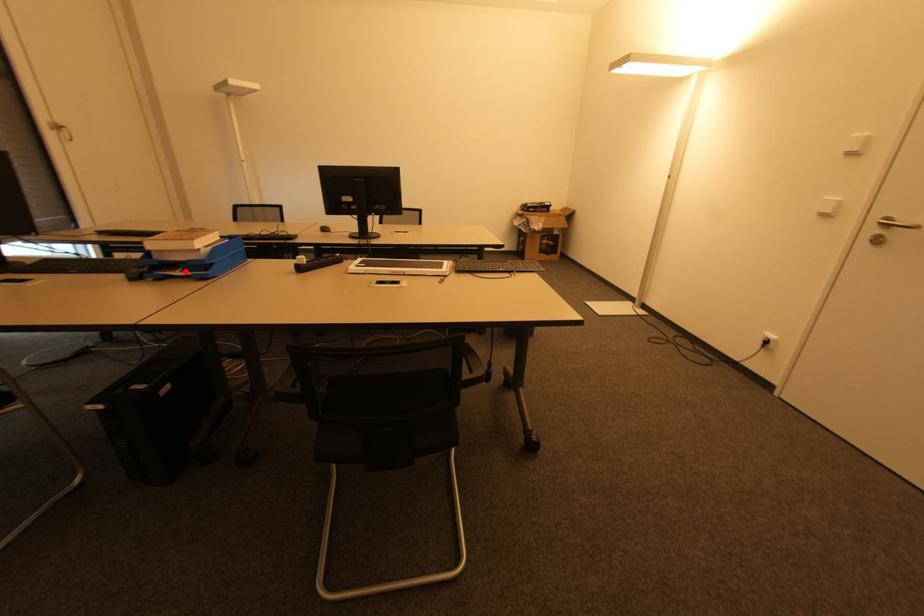
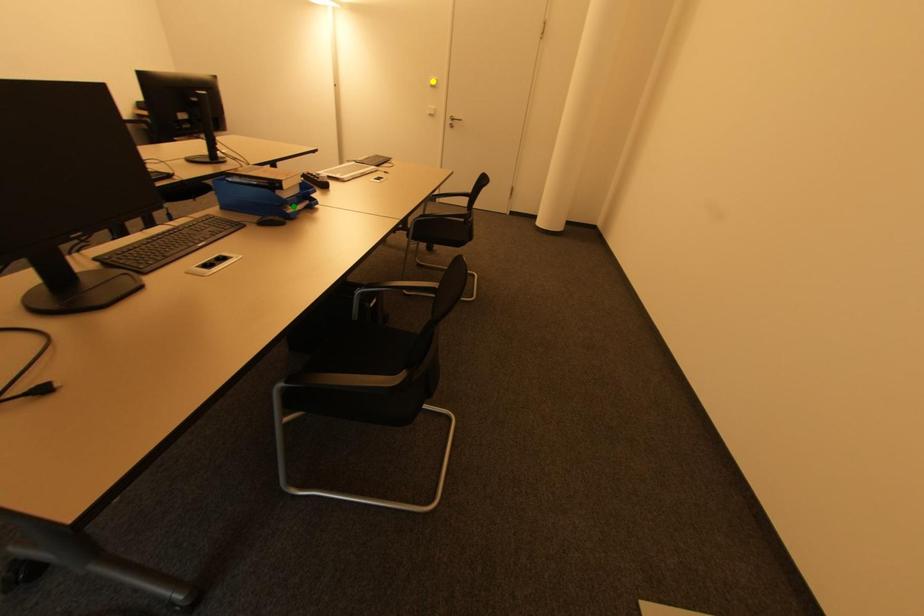
Question: I am providing you with two images of the same scene from different viewpoints. A red point is marked on the first image. You are given multiple points on the second image. Which point in image 2 is actually the same real-world point as the red point in image 1?

Choices:
 (A) blue point
 (B) green point
 (C) yellow point

Answer: (B)